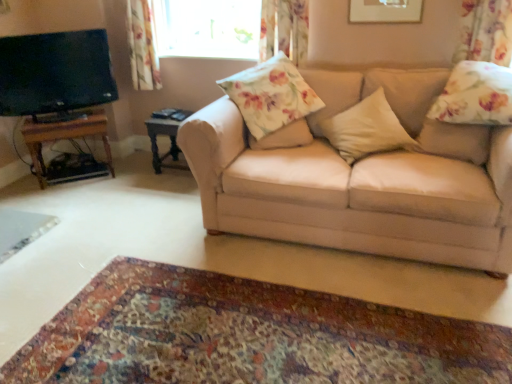
What do you see at coordinates (69, 140) in the screenshot? This screenshot has width=512, height=384. I see `wooden table at left, which ranks as the 2th table in right-to-left order` at bounding box center [69, 140].

The width and height of the screenshot is (512, 384). Identify the location of matte black tv at left. (55, 72).

From the picture: Measure the distance between point (94, 54) and camera.

Point (94, 54) and camera are 3.01 meters apart from each other.

At what (x,y) coordinates should I click in order to perform the action: click on transparent glass window at upper center. Please return your answer as a coordinate pair (x, y). The width and height of the screenshot is (512, 384). Looking at the image, I should click on (207, 28).

Identify the location of television that is behind the floral fabric curtain at upper right, which is the 3th curtain from left to right. (55, 72).

From their relative heights in the image, would you say floral fabric curtain at upper right, the first curtain viewed from the front, is taller or shorter than matte black tv at left?

In the image, floral fabric curtain at upper right, the first curtain viewed from the front, appears to be shorter than matte black tv at left.

Does floral fabric curtain at upper right, placed as the third curtain when sorted from back to front, touch matte black tv at left?

floral fabric curtain at upper right, placed as the third curtain when sorted from back to front, is not next to matte black tv at left, and they're not touching.

Consider the image. From a real-world perspective, is floral fabric curtain at upper right, the first curtain viewed from the front, physically above matte black tv at left?

Yes, from a real-world perspective, floral fabric curtain at upper right, the first curtain viewed from the front, is over matte black tv at left

From a real-world perspective, starting from the wooden table at left, which appears as the 1th table when viewed from the left, which curtain is the 2nd one vertically above it? Please provide its 2D coordinates.

[(284, 28)]

From a real-world perspective, which is physically below, floral fabric curtain at upper center, which is the 2th curtain from back to front, or wooden table at left, which ranks as the 2th table in right-to-left order?

In real-world perspective, wooden table at left, which ranks as the 2th table in right-to-left order, is lower.

Considering the positions of objects floral fabric curtain at upper center, which ranks as the 2th curtain in left-to-right order, and wooden table at left, which appears as the 1th table when viewed from the left, in the image provided, who is in front, floral fabric curtain at upper center, which ranks as the 2th curtain in left-to-right order, or wooden table at left, which appears as the 1th table when viewed from the left,?

floral fabric curtain at upper center, which ranks as the 2th curtain in left-to-right order, is closer to the camera.

Is point (270, 11) in front of point (24, 133)?

Yes, it is.

Does dark wood side table at center, which is counted as the second table, starting from the left, turn towards carpet at lower center?

No, dark wood side table at center, which is counted as the second table, starting from the left, does not turn towards carpet at lower center.

From the picture: Considering the sizes of objects dark wood side table at center, marked as the first table in a right-to-left arrangement, and carpet at lower center in the image provided, who is taller, dark wood side table at center, marked as the first table in a right-to-left arrangement, or carpet at lower center?

With more height is dark wood side table at center, marked as the first table in a right-to-left arrangement.

Does point (157, 159) come closer to viewer compared to point (297, 296)?

That is False.

Is carpet at lower center surrounded by dark wood side table at center, which is counted as the second table, starting from the left?

No, dark wood side table at center, which is counted as the second table, starting from the left, does not contain carpet at lower center.

Can you confirm if floral fabric pillow at center, marked as the first pillow in a left-to-right arrangement, is wider than floral fabric pillow at right, the 3th pillow positioned from the left?

No, floral fabric pillow at center, marked as the first pillow in a left-to-right arrangement, is not wider than floral fabric pillow at right, the 3th pillow positioned from the left.

Is floral fabric pillow at center, the third pillow when ordered from right to left, oriented towards floral fabric pillow at right, placed as the first pillow when sorted from right to left?

No, floral fabric pillow at center, the third pillow when ordered from right to left, is not aimed at floral fabric pillow at right, placed as the first pillow when sorted from right to left.

From a real-world perspective, is floral fabric pillow at center, the third pillow when ordered from right to left, physically below floral fabric pillow at right, placed as the first pillow when sorted from right to left?

Correct, in the physical world, floral fabric pillow at center, the third pillow when ordered from right to left, is lower than floral fabric pillow at right, placed as the first pillow when sorted from right to left.

From the image's perspective, who appears lower, floral fabric pillow at center, the third pillow when ordered from right to left, or floral fabric pillow at right, the 3th pillow positioned from the left?

floral fabric pillow at center, the third pillow when ordered from right to left.

Is matte black tv at left looking in the opposite direction of floral fabric pillow at center, the third pillow when ordered from right to left?

No, matte black tv at left's orientation is not away from floral fabric pillow at center, the third pillow when ordered from right to left.

From a real-world perspective, is matte black tv at left on top of floral fabric pillow at center, the third pillow when ordered from right to left?

Yes, from a real-world perspective, matte black tv at left is on top of floral fabric pillow at center, the third pillow when ordered from right to left.

What's the angular difference between matte black tv at left and floral fabric pillow at center, marked as the first pillow in a left-to-right arrangement,'s facing directions?

11.6 degrees separate the facing orientations of matte black tv at left and floral fabric pillow at center, marked as the first pillow in a left-to-right arrangement.

Does carpet at lower center turn towards beige fabric couch at center?

No, carpet at lower center is not aimed at beige fabric couch at center.

Which of these two, carpet at lower center or beige fabric couch at center, stands taller?

Standing taller between the two is beige fabric couch at center.

Consider the image. Considering the relative positions of carpet at lower center and beige fabric couch at center in the image provided, is carpet at lower center to the right of beige fabric couch at center from the viewer's perspective?

No.

Is carpet at lower center spatially inside beige fabric couch at center, or outside of it?

The correct answer is: outside.

Between carpet at lower center and floral fabric curtain at upper center, which is the 2th curtain from back to front, which one has larger width?

With larger width is carpet at lower center.

Would you consider carpet at lower center to be distant from floral fabric curtain at upper center, which is the 2th curtain from back to front?

carpet at lower center is far away from floral fabric curtain at upper center, which is the 2th curtain from back to front.

Is carpet at lower center to the right of floral fabric curtain at upper center, arranged as the 2th curtain when viewed from the right, from the viewer's perspective?

In fact, carpet at lower center is to the left of floral fabric curtain at upper center, arranged as the 2th curtain when viewed from the right.

From the image's perspective, which is below, carpet at lower center or floral fabric curtain at upper center, which is the 2th curtain from back to front?

carpet at lower center appears lower in the image.

Where is `the 1st curtain above when counting from the matte black tv at left (from the image's perspective)`? The width and height of the screenshot is (512, 384). the 1st curtain above when counting from the matte black tv at left (from the image's perspective) is located at coordinates (485, 32).

From the floral fabric curtain at upper center, arranged as the 2th curtain when viewed from the right, count 1st tables backward and point to it. Please provide its 2D coordinates.

[(69, 140)]

From the image, which object appears to be farther from matte black tv at left, floral fabric pillow at center, the third pillow when ordered from right to left, or floral fabric curtain at upper left, which ranks as the 3th curtain in front-to-back order?

floral fabric pillow at center, the third pillow when ordered from right to left, lies further to matte black tv at left than the other object.

Looking at the image, which one is located closer to floral fabric pillow at center, matte black tv at left or beige fabric couch at center?

beige fabric couch at center.

Looking at the image, which one is located further to floral fabric curtain at upper right, which is the 3th curtain from left to right, wooden table at left, which ranks as the 2th table in right-to-left order, or floral fabric curtain at upper left, the 1th curtain from the back?

Based on the image, wooden table at left, which ranks as the 2th table in right-to-left order, appears to be further to floral fabric curtain at upper right, which is the 3th curtain from left to right.

Estimate the real-world distances between objects in this image. Which object is further from wooden table at left, which ranks as the 2th table in right-to-left order, beige fabric pillow at center, positioned as the second pillow in left-to-right order, or floral fabric pillow at center, the third pillow when ordered from right to left?

Among the two, beige fabric pillow at center, positioned as the second pillow in left-to-right order, is located further to wooden table at left, which ranks as the 2th table in right-to-left order.

Which object lies further to the anchor point wooden table at left, which ranks as the 2th table in right-to-left order, floral fabric pillow at center, the third pillow when ordered from right to left, or carpet at lower center?

carpet at lower center is further to wooden table at left, which ranks as the 2th table in right-to-left order.

From the image, which object appears to be nearer to floral fabric pillow at center, floral fabric curtain at upper center, arranged as the 2th curtain when viewed from the right, or carpet at lower center?

The object closer to floral fabric pillow at center is floral fabric curtain at upper center, arranged as the 2th curtain when viewed from the right.

Looking at the image, which one is located further to floral fabric curtain at upper right, which is the 3th curtain from left to right, dark wood side table at center, which is counted as the second table, starting from the left, or matte black tv at left?

matte black tv at left is positioned further to the anchor floral fabric curtain at upper right, which is the 3th curtain from left to right.

Considering their positions, is floral fabric curtain at upper left, which ranks as the 3th curtain in front-to-back order, positioned further to floral fabric curtain at upper center, which is the 2th curtain from back to front, than wooden table at left, which appears as the 1th table when viewed from the left?

wooden table at left, which appears as the 1th table when viewed from the left, is positioned further to the anchor floral fabric curtain at upper center, which is the 2th curtain from back to front.

Where is `plain between matte black tv at left and beige fabric pillow at center, the second pillow from the right, in the horizontal direction`? Image resolution: width=512 pixels, height=384 pixels. plain between matte black tv at left and beige fabric pillow at center, the second pillow from the right, in the horizontal direction is located at coordinates (247, 335).

Where is `curtain situated between floral fabric pillow at center, the third pillow when ordered from right to left, and floral fabric curtain at upper right, the first curtain in the right-to-left sequence, from left to right`? This screenshot has height=384, width=512. curtain situated between floral fabric pillow at center, the third pillow when ordered from right to left, and floral fabric curtain at upper right, the first curtain in the right-to-left sequence, from left to right is located at coordinates (284, 28).

You are a GUI agent. You are given a task and a screenshot of the screen. Output one action in this format:
    pyautogui.click(x=<x>, y=<y>)
    Task: Click on the studio couch located between floral fabric curtain at upper left, which ranks as the 3th curtain in front-to-back order, and floral fabric pillow at right, the 3th pillow positioned from the left, in the left-right direction
    Image resolution: width=512 pixels, height=384 pixels.
    Given the screenshot: What is the action you would take?
    (x=357, y=180)

Locate an element on the screen. The image size is (512, 384). window located between matte black tv at left and beige fabric couch at center in the left-right direction is located at coordinates (207, 28).